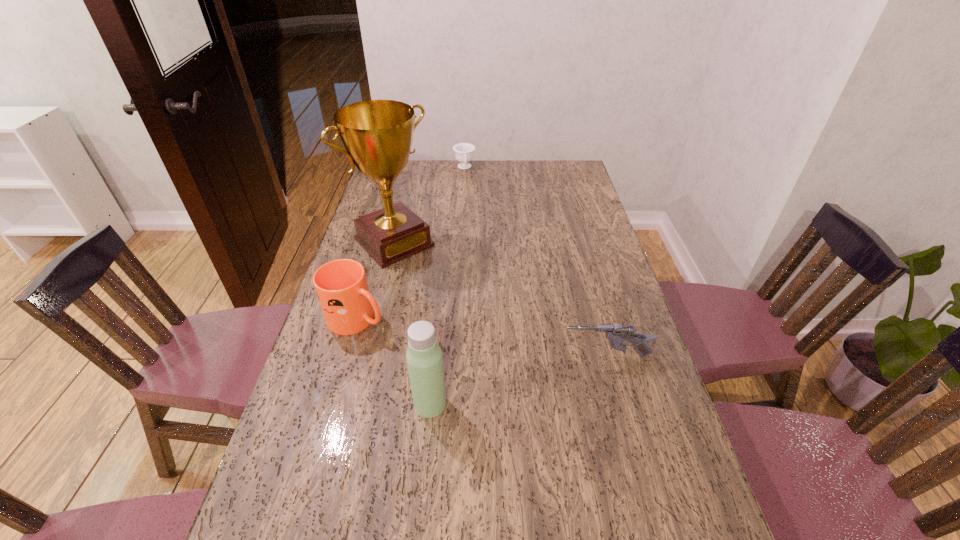
The height and width of the screenshot is (540, 960). Find the location of `free space located 0.110m on the side of the shortest object with the handle`. free space located 0.110m on the side of the shortest object with the handle is located at coordinates (468, 187).

Image resolution: width=960 pixels, height=540 pixels. Identify the location of vacant space located 0.050m on the side of the shortest object with the handle. click(467, 180).

Where is `vacant space located 0.140m on the side of the shortest object with the handle`? vacant space located 0.140m on the side of the shortest object with the handle is located at coordinates (468, 191).

Find the location of `object situated at the far edge`. object situated at the far edge is located at coordinates (464, 152).

You are a GUI agent. You are given a task and a screenshot of the screen. Output one action in this format:
    pyautogui.click(x=<x>, y=<y>)
    Task: Click on the mug positioned at the left edge
    The height and width of the screenshot is (540, 960).
    Given the screenshot: What is the action you would take?
    pyautogui.click(x=341, y=286)

At what (x,y) coordinates should I click in order to perform the action: click on award that is at the left edge. Please return your answer as a coordinate pair (x, y). This screenshot has width=960, height=540. Looking at the image, I should click on (377, 134).

This screenshot has height=540, width=960. In order to click on object positioned at the right edge in this screenshot , I will do `click(616, 333)`.

Locate an element on the screen. vacant space at the far edge of the desktop is located at coordinates (493, 163).

Find the location of `vacant position at the near edge of the desktop`. vacant position at the near edge of the desktop is located at coordinates (398, 526).

The width and height of the screenshot is (960, 540). In order to click on vacant space at the left edge of the desktop in this screenshot , I will do `click(373, 200)`.